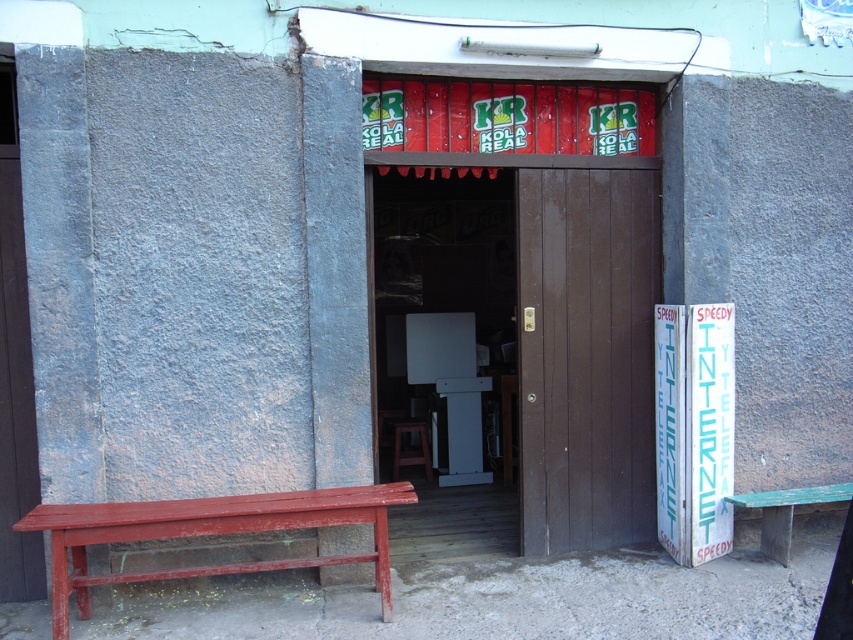
Question: Estimate the real-world distances between objects in this image. Which object is closer to the brown wooden stool at center?

Choices:
 (A) rustic wood bench at left
 (B) green wooden bench at lower right
 (C) brown wooden door at center

Answer: (C)

Question: Which point is farther to the camera?

Choices:
 (A) (785, 557)
 (B) (364, 499)

Answer: (A)

Question: Can you confirm if green wooden bench at lower right is bigger than brown wooden stool at center?

Choices:
 (A) yes
 (B) no

Answer: (A)

Question: Does green wooden bench at lower right appear on the left side of brown wooden stool at center?

Choices:
 (A) yes
 (B) no

Answer: (B)

Question: Does brown wooden door at center appear under brown wooden stool at center?

Choices:
 (A) no
 (B) yes

Answer: (A)

Question: Estimate the real-world distances between objects in this image. Which object is farther from the rustic wood bench at left?

Choices:
 (A) green wooden bench at lower right
 (B) brown wooden door at center
 (C) brown wooden stool at center

Answer: (C)